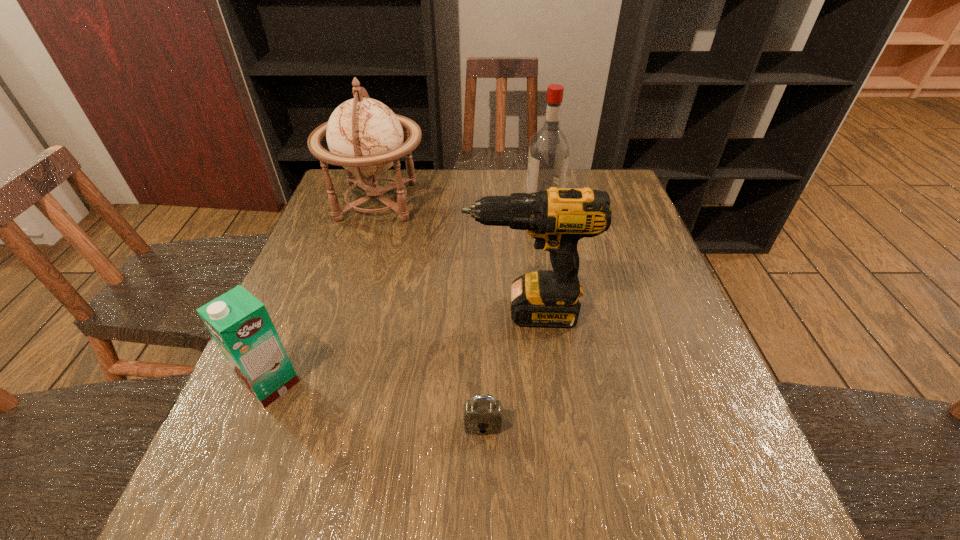
At what (x,y) coordinates should I click in order to perform the action: click on free spot between the fourth tallest object and the globe. Please return your answer as a coordinate pair (x, y). Looking at the image, I should click on (324, 293).

Find the location of a particular element. Image resolution: width=960 pixels, height=540 pixels. vacant space that is in between the liquor and the drill is located at coordinates (535, 256).

Find the location of `vacant point located between the liquor and the globe`. vacant point located between the liquor and the globe is located at coordinates (460, 201).

This screenshot has width=960, height=540. I want to click on vacant space that is in between the padlock and the third farthest object, so click(504, 368).

Identify the location of empty space that is in between the second nearest object and the third nearest object. (398, 348).

This screenshot has width=960, height=540. Find the location of `vacant space in between the carton and the liquor`. vacant space in between the carton and the liquor is located at coordinates (407, 292).

Where is `empty space that is in between the globe and the liquor`? This screenshot has height=540, width=960. empty space that is in between the globe and the liquor is located at coordinates (460, 201).

Locate an element on the screen. The image size is (960, 540). object that stands as the closest to the second shortest object is located at coordinates (482, 415).

This screenshot has height=540, width=960. Identify the location of the closest object to the third farthest object. coord(482,415).

You are a GUI agent. You are given a task and a screenshot of the screen. Output one action in this format:
    pyautogui.click(x=<x>, y=<y>)
    Task: Click on the vacant region that satisfies the following two spatial constraints: 1. on the front-facing side of the globe; 2. on the front side of the fourth tallest object
    
    Given the screenshot: What is the action you would take?
    pyautogui.click(x=322, y=384)